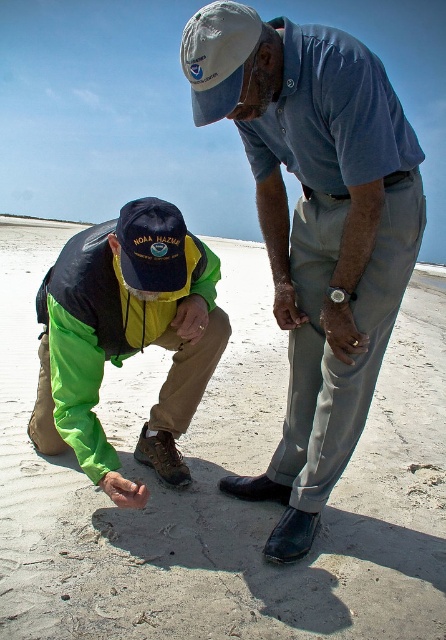
Is smooth sand at lower center behind white fabric baseball cap at upper center?

No, smooth sand at lower center is in front of white fabric baseball cap at upper center.

Which of these two, smooth sand at lower center or white fabric baseball cap at upper center, stands shorter?

With less height is white fabric baseball cap at upper center.

Does point (24, 456) come in front of point (240, 35)?

That is False.

Locate an element on the screen. This screenshot has height=640, width=446. smooth sand at lower center is located at coordinates (217, 486).

Is blue cotton shirt at upper center above green fabric jacket at lower left?

Correct, blue cotton shirt at upper center is located above green fabric jacket at lower left.

Between point (301, 353) and point (152, 243), which one is positioned behind?

The point (301, 353) is behind.

Locate an element on the screen. The width and height of the screenshot is (446, 640). blue cotton shirt at upper center is located at coordinates (316, 228).

Between point (31, 481) and point (374, 230), which one is positioned behind?

Point (31, 481)

Does smooth sand at lower center have a larger size compared to blue cotton shirt at upper center?

Correct, smooth sand at lower center is larger in size than blue cotton shirt at upper center.

Is point (407, 353) closer to camera compared to point (375, 360)?

No, (407, 353) is further to viewer.

Identify the location of smooth sand at lower center. (217, 486).